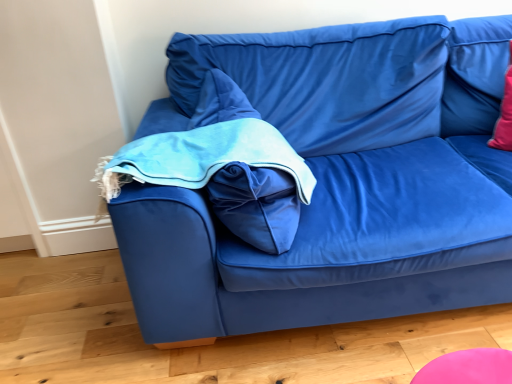
Question: Looking at the image, does velvet blue couch at center seem bigger or smaller compared to velvet blue bean bag chair at center-left?

Choices:
 (A) big
 (B) small

Answer: (A)

Question: Would you say velvet blue couch at center is to the left or to the right of velvet blue bean bag chair at center-left in the picture?

Choices:
 (A) right
 (B) left

Answer: (A)

Question: In terms of height, does velvet blue couch at center look taller or shorter compared to velvet blue bean bag chair at center-left?

Choices:
 (A) short
 (B) tall

Answer: (B)

Question: Is point (215, 200) positioned closer to the camera than point (202, 205)?

Choices:
 (A) farther
 (B) closer

Answer: (A)

Question: In the image, is velvet blue bean bag chair at center-left on the left side or the right side of velvet blue couch at center?

Choices:
 (A) right
 (B) left

Answer: (B)

Question: Looking at their shapes, would you say velvet blue bean bag chair at center-left is wider or thinner than velvet blue couch at center?

Choices:
 (A) wide
 (B) thin

Answer: (B)

Question: Which is correct: velvet blue bean bag chair at center-left is inside velvet blue couch at center, or outside of it?

Choices:
 (A) outside
 (B) inside

Answer: (B)